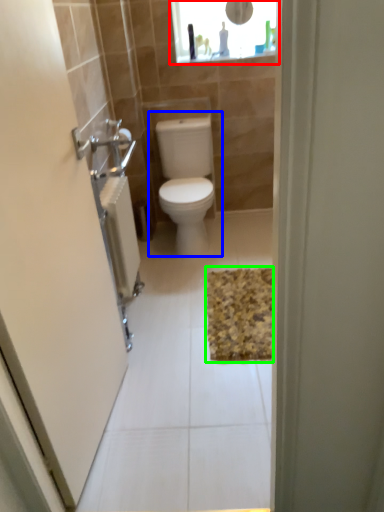
Question: Based on their relative distances, which object is nearer to medicine cabinet (highlighted by a red box)? Choose from toilet (highlighted by a blue box) and bath mat (highlighted by a green box).

Choices:
 (A) toilet
 (B) bath mat

Answer: (A)